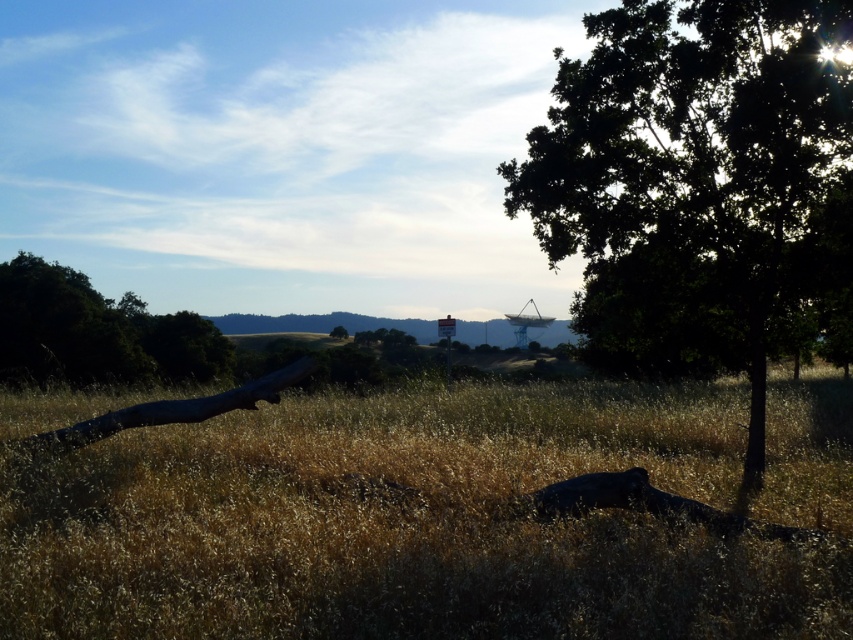
Which is more to the left, dry grass at center or green leafy tree at left?

green leafy tree at left

Can you confirm if dry grass at center is positioned to the left of green leafy tree at left?

→ No, dry grass at center is not to the left of green leafy tree at left.

Does point (822, 472) come in front of point (115, 348)?

Yes, point (822, 472) is closer to viewer.

This screenshot has width=853, height=640. In order to click on dry grass at center in this screenshot , I will do `click(404, 524)`.

Which is above, dry grass at center or green matte tree at center?

green matte tree at center is above.

Is dry grass at center taller than green matte tree at center?

No.

The width and height of the screenshot is (853, 640). I want to click on dry grass at center, so click(x=404, y=524).

Which is in front, point (611, 195) or point (334, 336)?

Positioned in front is point (611, 195).

Does green leafy tree at center lie behind green matte tree at center?

No, green leafy tree at center is in front of green matte tree at center.

Does point (804, 118) lie in front of point (347, 336)?

Yes, point (804, 118) is closer to viewer.

Where is `green leafy tree at center`? green leafy tree at center is located at coordinates (689, 179).